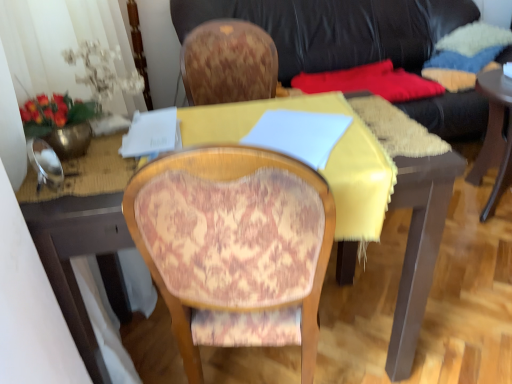
Question: Is black leather couch at upper center taller or shorter than yellow fabric-covered desk at center?

Choices:
 (A) tall
 (B) short

Answer: (A)

Question: Would you say black leather couch at upper center is to the left or to the right of yellow fabric-covered desk at center in the picture?

Choices:
 (A) right
 (B) left

Answer: (A)

Question: Estimate the real-world distances between objects in this image. Which object is closer to the black leather couch at upper center?

Choices:
 (A) patterned fabric chair at center
 (B) yellow fabric-covered desk at center

Answer: (B)

Question: Which object is the closest to the black leather couch at upper center?

Choices:
 (A) patterned fabric chair at center
 (B) yellow fabric-covered desk at center

Answer: (B)